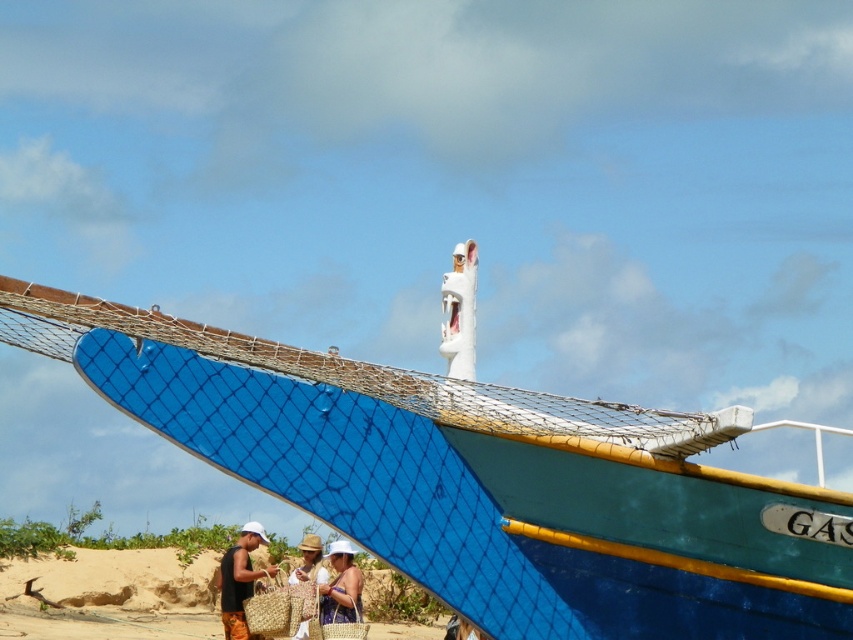
You are a photographer trying to capture the blue painted wood boat at center and the beige woven baskets at lower center in the same frame. Given their sizes, which object would you need to position closer to the camera to ensure both fit well in the photo?

Since the blue painted wood boat at center is smaller than the beige woven baskets at lower center, you should position the boat closer to the camera to balance their sizes in the photo.

You are a photographer standing at the edge of the beach. You want to take a photo that includes both the blue painted wood boat at center and the beige woven baskets at lower center. Based on their positions, which object should you place closer to the left side of your camera frame?

The beige woven baskets at lower center should be placed closer to the left side of the camera frame because the blue painted wood boat at center is positioned to the right of them.

You are standing on the beach and see the blue painted wood boat at center and the beige woven hat at center. Which object is positioned to the right side?

The blue painted wood boat at center is to the right of the beige woven hat at center, so the boat is positioned to the right side.